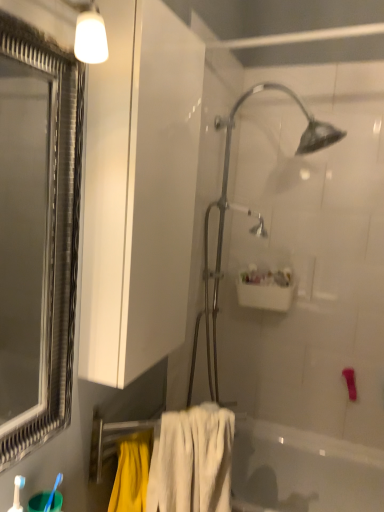
Describe the element at coordinates (37, 234) in the screenshot. The image size is (384, 512). I see `metallic frame at left` at that location.

Measure the distance between white glossy sink at upper center and camera.

white glossy sink at upper center is 2.05 meters from camera.

Locate an element on the screen. Image resolution: width=384 pixels, height=512 pixels. blue plastic toothbrush at lower left is located at coordinates (53, 492).

Describe the element at coordinates (302, 471) in the screenshot. This screenshot has height=512, width=384. I see `white glossy bathtub at lower center` at that location.

Measure the distance between white glossy cabinet at upper left and camera.

The distance of white glossy cabinet at upper left from camera is 96.45 centimeters.

Identify the location of metallic frame at left. (37, 234).

From the image's perspective, who appears lower, white glossy sink at upper center or white glossy bathtub at lower center?

From the image's view, white glossy bathtub at lower center is below.

Who is more distant, white glossy sink at upper center or white glossy bathtub at lower center?

white glossy sink at upper center is further away from the camera.

Is white glossy sink at upper center not near white glossy bathtub at lower center?

No, white glossy sink at upper center is not far from white glossy bathtub at lower center.

What are the coordinates of `bathtub on the right of white glossy sink at upper center` in the screenshot? It's located at (302, 471).

From the image's perspective, is white glossy bathtub at lower center located beneath white glossy sink at upper center?

Yes.

Is white glossy bathtub at lower center far away from white glossy sink at upper center?

white glossy bathtub at lower center is near white glossy sink at upper center, not far away.

From a real-world perspective, is white glossy bathtub at lower center positioned over white glossy sink at upper center based on gravity?

No, from a real-world perspective, white glossy bathtub at lower center is not over white glossy sink at upper center

Looking at this image, how distant is blue plastic toothbrush at lower left from white soft towel at lower center?

blue plastic toothbrush at lower left is 42.73 centimeters away from white soft towel at lower center.

Is point (55, 481) positioned in front of point (189, 460)?

Yes, it is in front of point (189, 460).

Considering the relative sizes of blue plastic toothbrush at lower left and white soft towel at lower center in the image provided, is blue plastic toothbrush at lower left thinner than white soft towel at lower center?

Indeed, blue plastic toothbrush at lower left has a lesser width compared to white soft towel at lower center.

Could you tell me if blue plastic toothbrush at lower left is turned towards white soft towel at lower center?

No.

Is the position of metallic silver shower head at center more distant than that of white glossy bathtub at lower center?

Yes.

Is point (251, 228) closer to camera compared to point (345, 503)?

No, (251, 228) is further to viewer.

Considering the positions of objects metallic silver shower head at center and white glossy bathtub at lower center in the image provided, who is more to the right, metallic silver shower head at center or white glossy bathtub at lower center?

white glossy bathtub at lower center is more to the right.

From the picture: Is metallic silver shower head at center facing away from white glossy bathtub at lower center?

No.

Which object is closer to the camera, white glossy cabinet at upper left or metallic silver shower head at center?

Positioned in front is white glossy cabinet at upper left.

Is white glossy cabinet at upper left located outside metallic silver shower head at center?

white glossy cabinet at upper left lies outside metallic silver shower head at center's area.

Who is taller, white glossy cabinet at upper left or metallic silver shower head at center?

Standing taller between the two is metallic silver shower head at center.

Is white glossy cabinet at upper left positioned far away from metallic silver shower head at center?

They are positioned close to each other.

Is white glossy cabinet at upper left far away from white glossy sink at upper center?

No, white glossy cabinet at upper left is in close proximity to white glossy sink at upper center.

From the image's perspective, is white glossy cabinet at upper left below white glossy sink at upper center?

Actually, white glossy cabinet at upper left appears above white glossy sink at upper center in the image.

Considering the positions of objects white glossy cabinet at upper left and white glossy sink at upper center in the image provided, who is more to the left, white glossy cabinet at upper left or white glossy sink at upper center?

From the viewer's perspective, white glossy cabinet at upper left appears more on the left side.

Can you tell me how much white glossy cabinet at upper left and white glossy sink at upper center differ in facing direction?

85.6 degrees.

From the image's perspective, who appears lower, white glossy bathtub at lower center or metallic frame at left?

white glossy bathtub at lower center is shown below in the image.

Between white glossy bathtub at lower center and metallic frame at left, which one has larger size?

With larger size is white glossy bathtub at lower center.

Is white glossy bathtub at lower center wider or thinner than metallic frame at left?

white glossy bathtub at lower center is wider than metallic frame at left.

Is white glossy bathtub at lower center taller or shorter than metallic frame at left?

Clearly, white glossy bathtub at lower center is shorter compared to metallic frame at left.

You are a GUI agent. You are given a task and a screenshot of the screen. Output one action in this format:
    pyautogui.click(x=<x>, y=<y>)
    Task: Click on the bathtub that is below the white glossy sink at upper center (from the image's perspective)
    
    Given the screenshot: What is the action you would take?
    pyautogui.click(x=302, y=471)

This screenshot has width=384, height=512. In the image, there is a white glossy bathtub at lower center. Identify the location of sink above it (from the image's perspective). (265, 289).

Which object lies further to the anchor point white soft towel at lower center, white glossy cabinet at upper left or white glossy bathtub at lower center?

white glossy bathtub at lower center lies further to white soft towel at lower center than the other object.

When comparing their distances from metallic frame at left, does white soft towel at lower center or white glossy bathtub at lower center seem further?

white soft towel at lower center lies further to metallic frame at left than the other object.

When comparing their distances from metallic frame at left, does blue plastic toothbrush at lower left or white glossy cabinet at upper left seem further?

Among the two, blue plastic toothbrush at lower left is located further to metallic frame at left.

From the image, which object appears to be nearer to white glossy sink at upper center, white glossy bathtub at lower center or white glossy cabinet at upper left?

white glossy bathtub at lower center lies closer to white glossy sink at upper center than the other object.

Estimate the real-world distances between objects in this image. Which object is further from blue plastic toothbrush at lower left, metallic frame at left or white glossy sink at upper center?

The object further to blue plastic toothbrush at lower left is metallic frame at left.

Consider the image. Looking at the image, which one is located closer to metallic silver shower head at center, white glossy bathtub at lower center or white soft towel at lower center?

white glossy bathtub at lower center is closer to metallic silver shower head at center.

Looking at the image, which one is located further to white glossy bathtub at lower center, white glossy sink at upper center or blue plastic toothbrush at lower left?

blue plastic toothbrush at lower left.

Looking at the image, which one is located further to metallic frame at left, white glossy sink at upper center or white soft towel at lower center?

white soft towel at lower center is positioned further to the anchor metallic frame at left.

Where is `towel/napkin between blue plastic toothbrush at lower left and white glossy sink at upper center along the z-axis`? This screenshot has height=512, width=384. towel/napkin between blue plastic toothbrush at lower left and white glossy sink at upper center along the z-axis is located at coordinates (192, 461).

At what (x,y) coordinates should I click in order to perform the action: click on window that lies between white glossy cabinet at upper left and white soft towel at lower center from top to bottom. Please return your answer as a coordinate pair (x, y). The height and width of the screenshot is (512, 384). Looking at the image, I should click on (37, 234).

You are a GUI agent. You are given a task and a screenshot of the screen. Output one action in this format:
    pyautogui.click(x=<x>, y=<y>)
    Task: Click on the toothbrush located between metallic frame at left and white glossy sink at upper center in the depth direction
    
    Given the screenshot: What is the action you would take?
    pyautogui.click(x=53, y=492)

Where is `toothbrush between metallic frame at left and white soft towel at lower center in the vertical direction`? The width and height of the screenshot is (384, 512). toothbrush between metallic frame at left and white soft towel at lower center in the vertical direction is located at coordinates (53, 492).